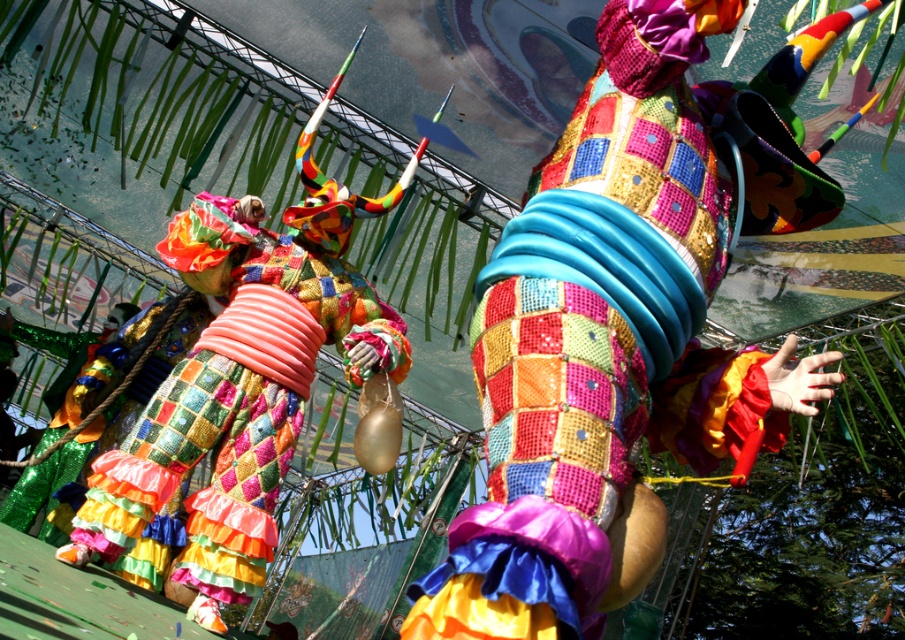
Is multicolored sequined costume at center to the right of multicolored sequined pants at center from the viewer's perspective?

Yes, multicolored sequined costume at center is to the right of multicolored sequined pants at center.

Describe the element at coordinates (620, 316) in the screenshot. This screenshot has height=640, width=905. I see `multicolored sequined costume at center` at that location.

The width and height of the screenshot is (905, 640). What are the coordinates of `multicolored sequined costume at center` in the screenshot? It's located at (620, 316).